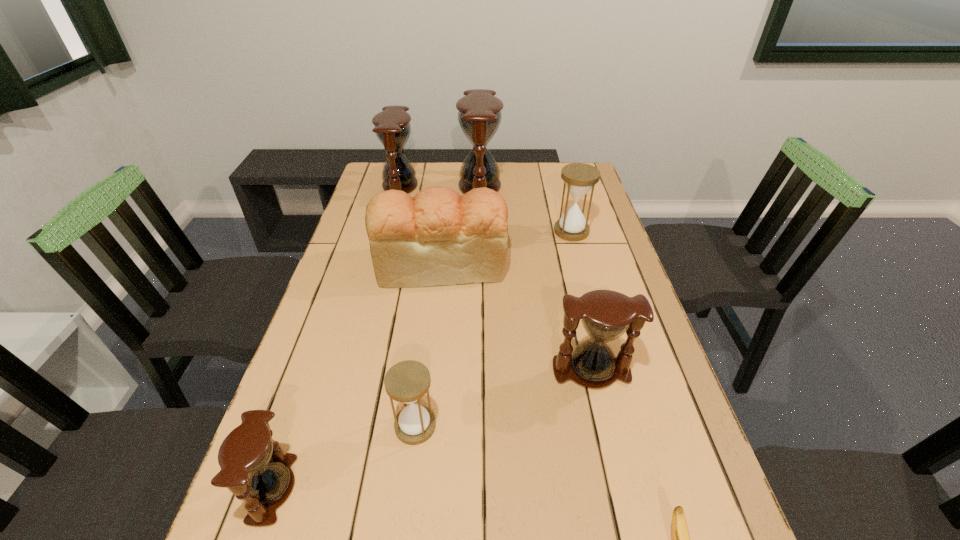
Locate an element on the screen. The height and width of the screenshot is (540, 960). the smallest brown hourglass is located at coordinates (254, 467).

This screenshot has height=540, width=960. In order to click on the nearest hourglass in this screenshot , I will do `click(254, 467)`.

The height and width of the screenshot is (540, 960). Identify the location of vacant region located on the right of the tallest object. (533, 187).

Find the location of a particular element. The image size is (960, 540). free space located on the front of the third smallest brown hourglass is located at coordinates (382, 255).

The height and width of the screenshot is (540, 960). Identify the location of free space located on the back of the bread. (448, 190).

Where is `vacant space located on the front of the third farthest object`? Image resolution: width=960 pixels, height=540 pixels. vacant space located on the front of the third farthest object is located at coordinates (587, 286).

Find the location of `vacant area located 0.390m on the left of the third biggest brown hourglass`. vacant area located 0.390m on the left of the third biggest brown hourglass is located at coordinates (385, 371).

The height and width of the screenshot is (540, 960). I want to click on free space located on the left of the nearer white hourglass, so click(x=295, y=426).

What are the coordinates of `vacant space situated on the back of the nearest brown hourglass` in the screenshot? It's located at [x=329, y=328].

Find the location of a particular element. bread located at the left edge is located at coordinates (438, 237).